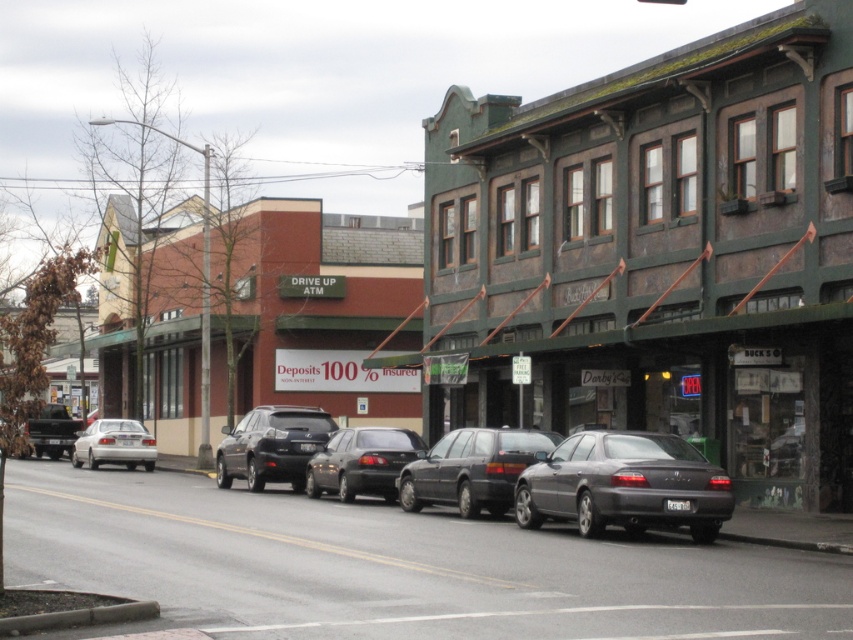
Question: Is green stone building at center wider than matte gray sedan at center?

Choices:
 (A) yes
 (B) no

Answer: (A)

Question: Which object is positioned farthest from the green stone building at center?

Choices:
 (A) matte black suv at center
 (B) silver metallic sedan at left
 (C) matte black station wagon at center

Answer: (B)

Question: Does green stone building at center have a smaller size compared to shiny black sedan at center?

Choices:
 (A) yes
 (B) no

Answer: (B)

Question: Which object appears farthest from the camera in this image?

Choices:
 (A) green stone building at center
 (B) shiny black sedan at center
 (C) matte gray sedan at center

Answer: (B)

Question: Which point is farther to the camera?

Choices:
 (A) (293, 474)
 (B) (387, 474)
 (C) (471, 483)

Answer: (A)

Question: Is shiny black sedan at center further to camera compared to silver metallic sedan at left?

Choices:
 (A) no
 (B) yes

Answer: (A)